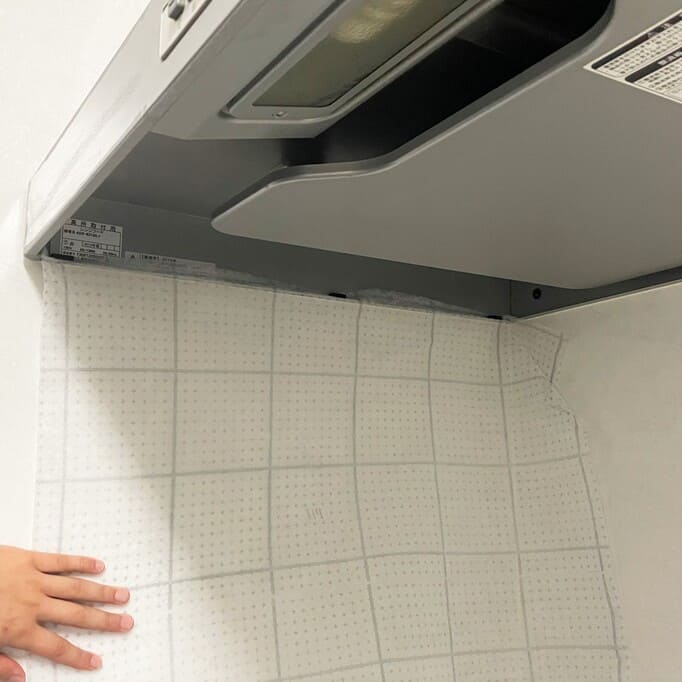
At what (x,y) coordinates should I click in order to perform the action: click on lense of light fixture. Please return your answer as a coordinate pair (x, y). This screenshot has height=682, width=682. Looking at the image, I should click on click(338, 57).